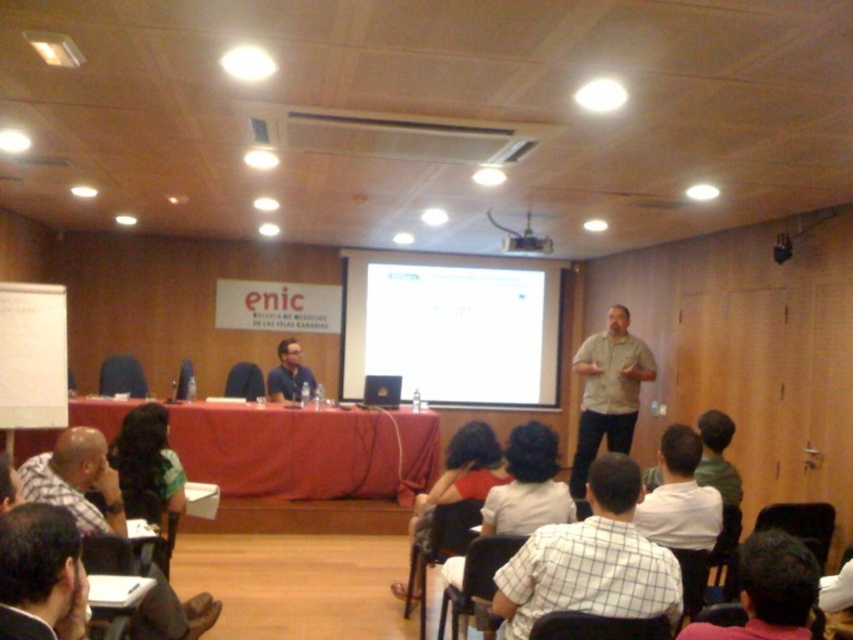
Question: Which of these objects is positioned farthest from the white checkered shirt at center?

Choices:
 (A) white shirt at lower center
 (B) plaid shirt at lower left

Answer: (B)

Question: Is plaid shirt at lower left to the left of matte blue shirt at center from the viewer's perspective?

Choices:
 (A) no
 (B) yes

Answer: (A)

Question: Is white glossy projection screen at center wider than dark brown hair at center?

Choices:
 (A) no
 (B) yes

Answer: (B)

Question: Based on their relative distances, which object is farther from the white checkered shirt at center?

Choices:
 (A) plaid shirt at lower left
 (B) white shirt at lower center

Answer: (A)

Question: In this image, where is dark brown hair at lower right located relative to matte blue shirt at center?

Choices:
 (A) above
 (B) below

Answer: (B)

Question: Estimate the real-world distances between objects in this image. Which object is closer to the dark brown hair at lower right?

Choices:
 (A) plaid shirt at lower left
 (B) dark brown hair at center
 (C) black plastic projector at upper center
 (D) white checkered shirt at center

Answer: (D)